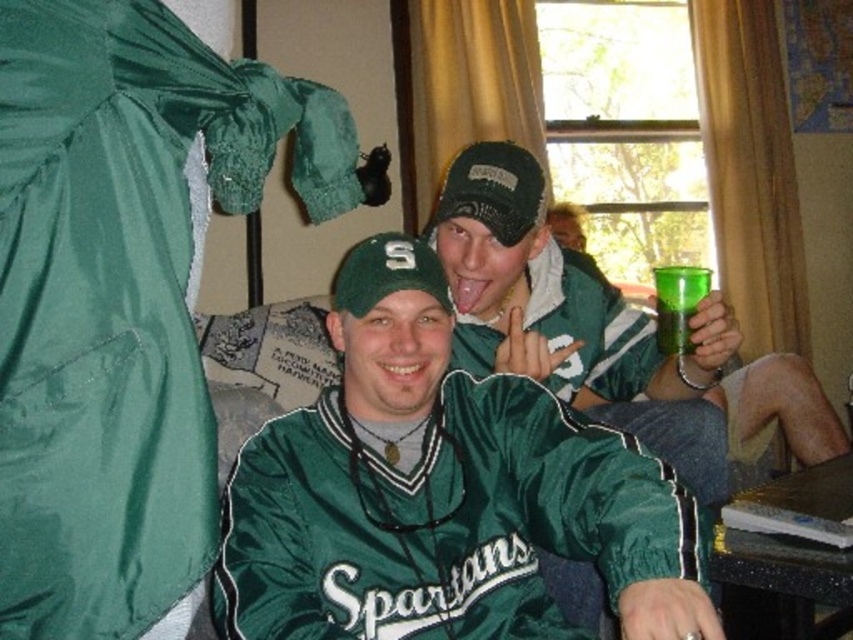
Question: Considering the real-world distances, which object is closest to the satin green dress at left?

Choices:
 (A) green plastic cup at upper right
 (B) green satin baseball uniform at center

Answer: (B)

Question: Which point appears closest to the camera in this image?

Choices:
 (A) (251, 476)
 (B) (682, 332)

Answer: (A)

Question: Can you confirm if green satin baseball uniform at center is positioned below green plastic cup at upper right?

Choices:
 (A) yes
 (B) no

Answer: (A)

Question: Is green satin baseball uniform at center thinner than green plastic cup at upper right?

Choices:
 (A) yes
 (B) no

Answer: (B)

Question: Does satin green dress at left appear on the left side of green satin baseball uniform at center?

Choices:
 (A) yes
 (B) no

Answer: (A)

Question: Among these objects, which one is farthest from the camera?

Choices:
 (A) green plastic cup at upper right
 (B) green satin baseball uniform at center
 (C) satin green dress at left

Answer: (A)